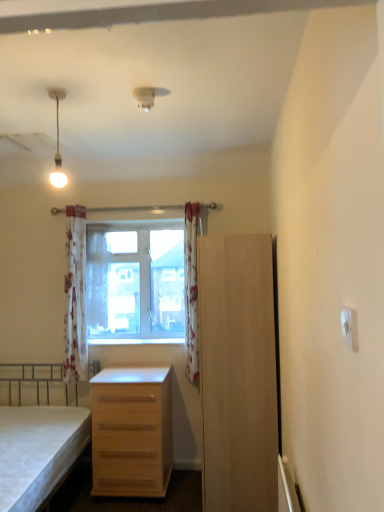
Question: Is transparent glass window at center located within light wood cabinet at right?

Choices:
 (A) yes
 (B) no

Answer: (B)

Question: From the image's perspective, is light wood cabinet at right under transparent glass window at center?

Choices:
 (A) no
 (B) yes

Answer: (B)

Question: Can you confirm if light wood cabinet at right is wider than transparent glass window at center?

Choices:
 (A) yes
 (B) no

Answer: (A)

Question: From a real-world perspective, is light wood cabinet at right beneath transparent glass window at center?

Choices:
 (A) yes
 (B) no

Answer: (A)

Question: Are light wood cabinet at right and transparent glass window at center beside each other?

Choices:
 (A) yes
 (B) no

Answer: (B)

Question: Is light wood drawer at center to the left or to the right of white glossy lamp at upper left in the image?

Choices:
 (A) right
 (B) left

Answer: (A)

Question: From the image's perspective, is light wood drawer at center located above or below white glossy lamp at upper left?

Choices:
 (A) below
 (B) above

Answer: (A)

Question: Do you think light wood drawer at center is within white glossy lamp at upper left, or outside of it?

Choices:
 (A) outside
 (B) inside

Answer: (A)

Question: Considering the positions of light wood drawer at center and white glossy lamp at upper left in the image, is light wood drawer at center wider or thinner than white glossy lamp at upper left?

Choices:
 (A) wide
 (B) thin

Answer: (A)

Question: From the image's perspective, is transparent glass window at center above or below white glossy lamp at upper left?

Choices:
 (A) above
 (B) below

Answer: (B)

Question: In terms of width, does transparent glass window at center look wider or thinner when compared to white glossy lamp at upper left?

Choices:
 (A) thin
 (B) wide

Answer: (B)

Question: In terms of height, does transparent glass window at center look taller or shorter compared to white glossy lamp at upper left?

Choices:
 (A) tall
 (B) short

Answer: (A)

Question: Based on their sizes in the image, would you say transparent glass window at center is bigger or smaller than white glossy lamp at upper left?

Choices:
 (A) big
 (B) small

Answer: (A)

Question: Is point (165, 440) positioned closer to the camera than point (84, 240)?

Choices:
 (A) closer
 (B) farther

Answer: (A)

Question: From a real-world perspective, is light wood drawer at center physically located above or below floral fabric curtain at center, the 3th curtain positioned from the right?

Choices:
 (A) above
 (B) below

Answer: (B)